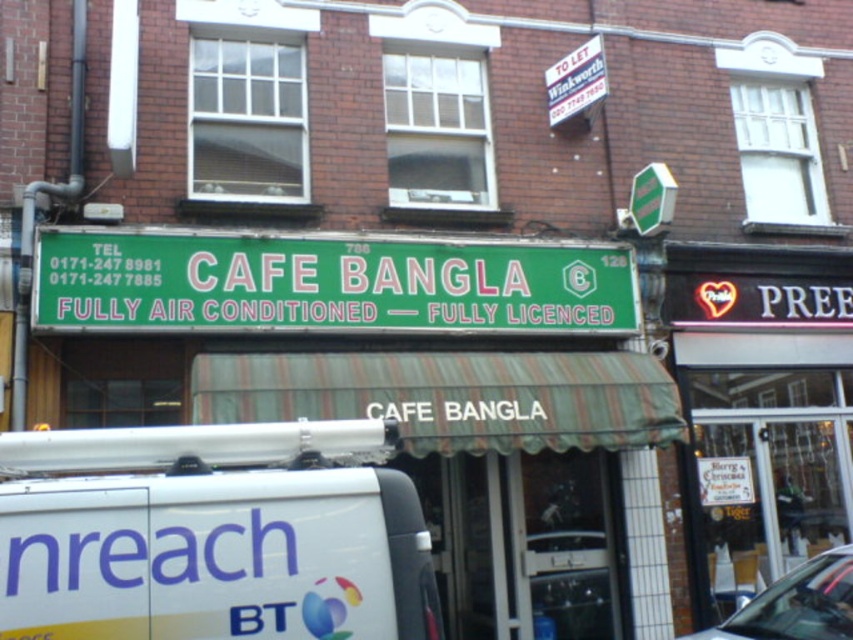
Between green plastic sign at center and metallic silver car at lower right, which one has less height?

metallic silver car at lower right is shorter.

Is point (357, 296) farther from camera compared to point (717, 632)?

Yes, it is.

Does point (273, 262) come farther from viewer compared to point (758, 616)?

Yes, it is behind point (758, 616).

The image size is (853, 640). Find the location of `green plastic sign at center`. green plastic sign at center is located at coordinates (328, 284).

Is point (367, 424) farther from camera compared to point (816, 620)?

No, (367, 424) is in front of (816, 620).

Can you confirm if white matte van at lower left is positioned to the right of metallic silver car at lower right?

In fact, white matte van at lower left is to the left of metallic silver car at lower right.

Does point (250, 566) lie behind point (741, 612)?

No.

This screenshot has width=853, height=640. In order to click on white matte van at lower left in this screenshot , I will do `click(212, 534)`.

Between white matte van at lower left and green plastic sign at center, which one is positioned lower?

Positioned lower is white matte van at lower left.

This screenshot has width=853, height=640. What are the coordinates of `white matte van at lower left` in the screenshot? It's located at (212, 534).

Image resolution: width=853 pixels, height=640 pixels. In order to click on white matte van at lower left in this screenshot , I will do `click(212, 534)`.